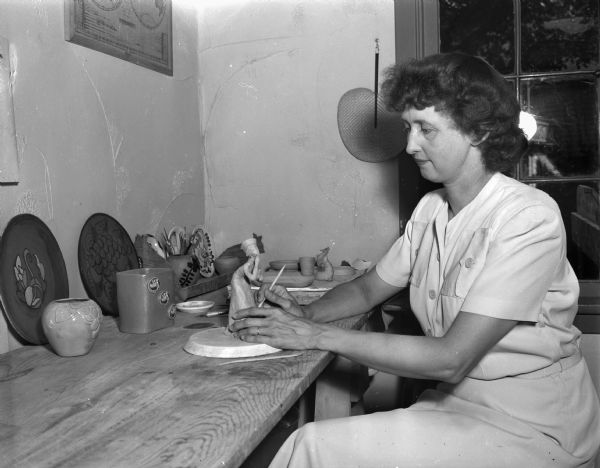
Find the location of a particular element. vase is located at coordinates (74, 317), (138, 305), (184, 263).